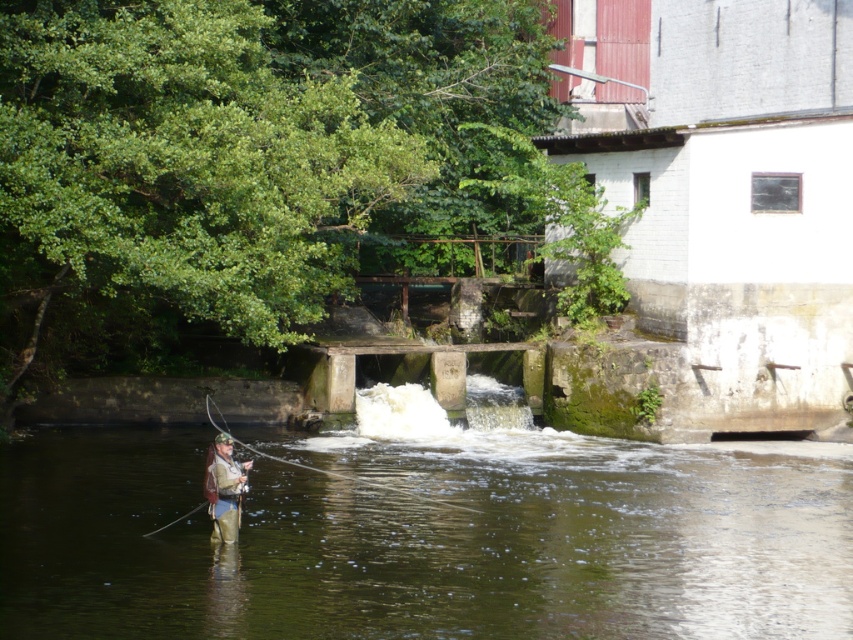
Where is `green mossy stone at center`? The width and height of the screenshot is (853, 640). green mossy stone at center is located at coordinates (422, 540).

Who is lower down, green mossy stone at center or camouflage jacket at center?

green mossy stone at center is below.

Does point (19, 634) come farther from viewer compared to point (212, 529)?

No, (19, 634) is in front of (212, 529).

Where is `green mossy stone at center`? green mossy stone at center is located at coordinates (422, 540).